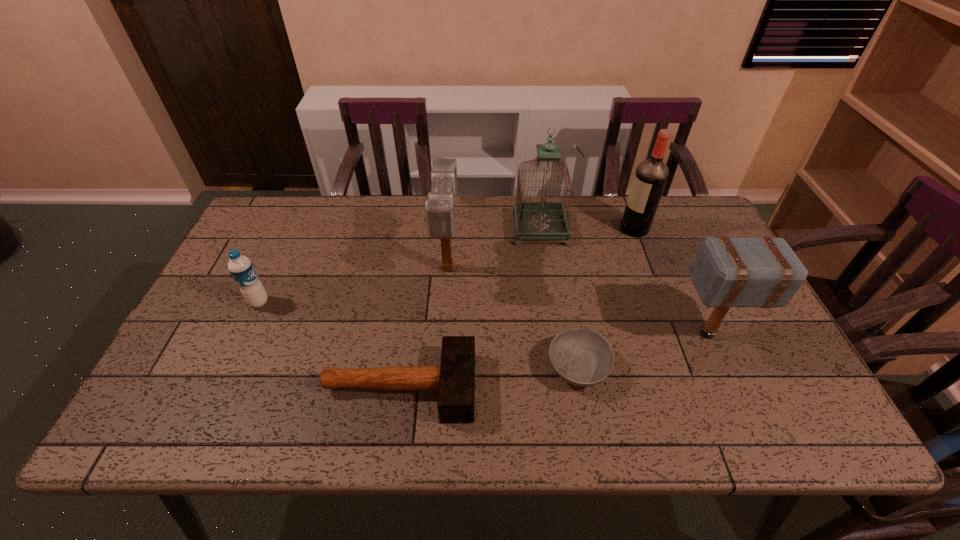
Where is `birdcage`? The image size is (960, 540). birdcage is located at coordinates (542, 220).

Where is `liquor`? The width and height of the screenshot is (960, 540). liquor is located at coordinates (651, 175).

At what (x,y) coordinates should I click in order to perform the action: click on the farthest mallet. Please return your answer as a coordinate pair (x, y). Looking at the image, I should click on (439, 208).

Where is `the rightmost mallet`? This screenshot has width=960, height=540. the rightmost mallet is located at coordinates (764, 272).

The height and width of the screenshot is (540, 960). Identify the location of the leftmost object. (241, 268).

Identify the location of water bottle. (241, 268).

At what (x,y) coordinates should I click in order to perform the action: click on the sixth tallest object. Please return your answer as a coordinate pair (x, y). Looking at the image, I should click on (454, 379).

Where is `the shortest object`? This screenshot has width=960, height=540. the shortest object is located at coordinates (581, 357).

Image resolution: width=960 pixels, height=540 pixels. I want to click on vacant space located 0.120m at the door of the birdcage, so click(x=476, y=229).

You are a GUI agent. You are given a task and a screenshot of the screen. Output one action in this format:
    pyautogui.click(x=<x>, y=<y>)
    Task: Click on the free space located 0.270m at the door of the birdcage
    This screenshot has width=960, height=540.
    Given the screenshot: What is the action you would take?
    pyautogui.click(x=429, y=229)